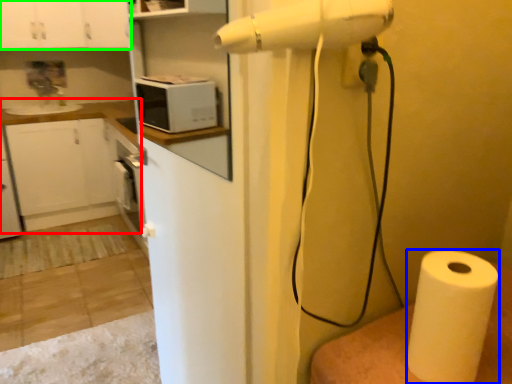
Question: Which object is the closest to the counter top (highlighted by a red box)? Choose among these: paper towel (highlighted by a blue box) or cabinetry (highlighted by a green box).

Choices:
 (A) paper towel
 (B) cabinetry

Answer: (B)